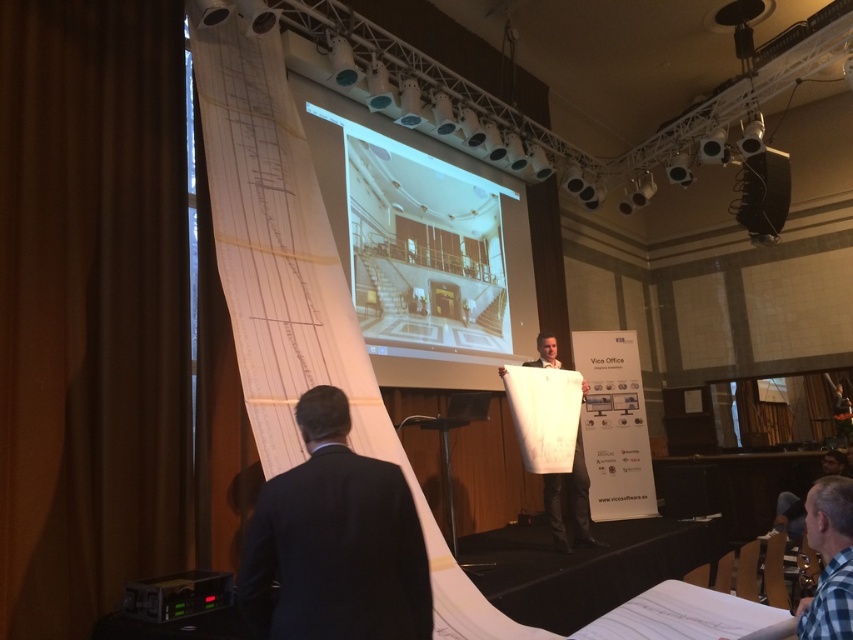
Based on the scene description, what object is located at the coordinates point [90,307]?

The brown fabric curtain at left is located at point [90,307].

You are an event organizer who needs to set up a microphone stand between the dark suit at lower left and the white paper at center. The stand requires a minimum of 2 meters of space to be placed safely. Can you fit it there?

The distance between the dark suit at lower left and the white paper at center is 3.20 meters, which is more than the required 2 meters. Therefore, the microphone stand can be safely placed between them.

Based on the photo, you are sitting in the audience of the presentation and want to know which of the two points, point [254,552] or point [541,333], is closer to you. Based on the scene, which one is nearer?

Point [254,552] is closer to the viewer than point [541,333].